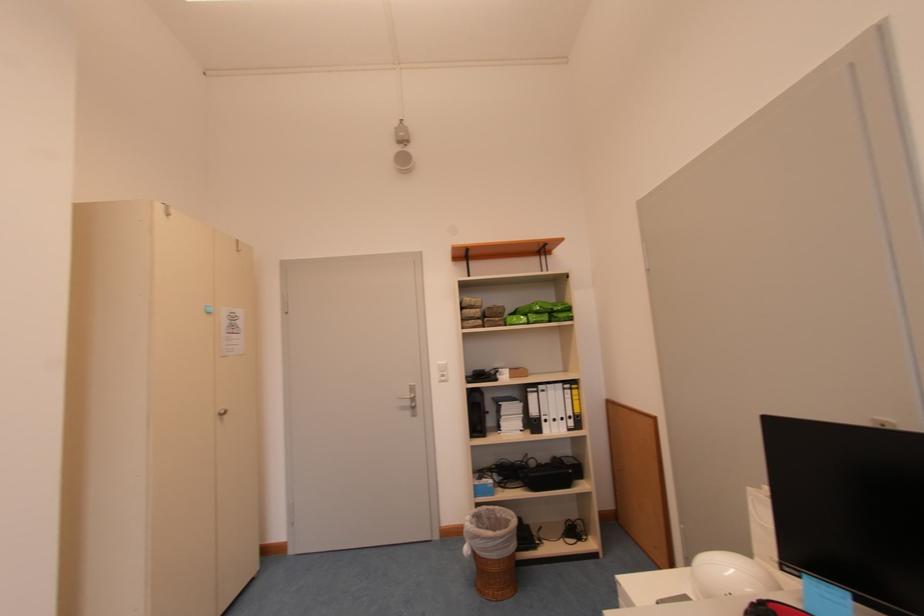
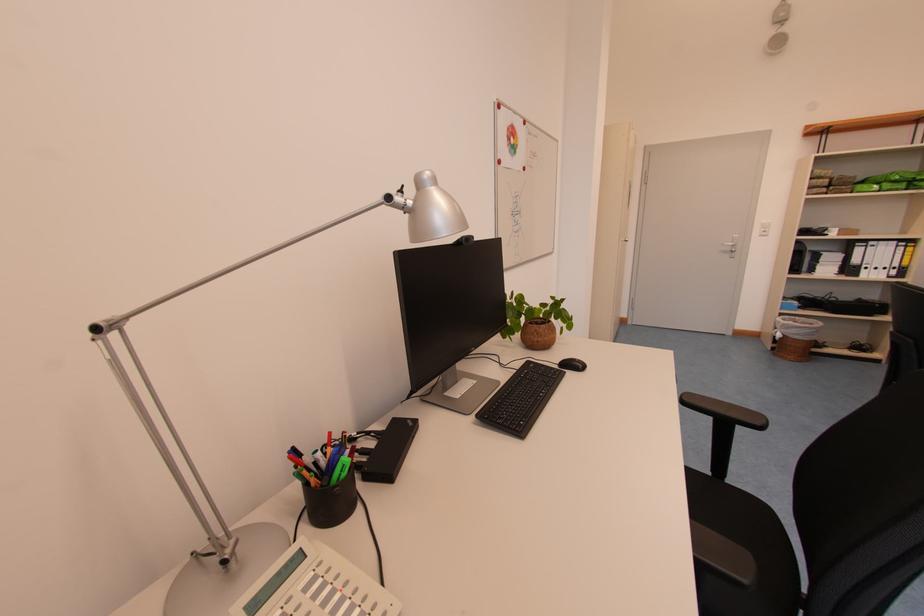
Locate, in the second image, the point that corresponds to (567,387) in the first image.

(903, 245)